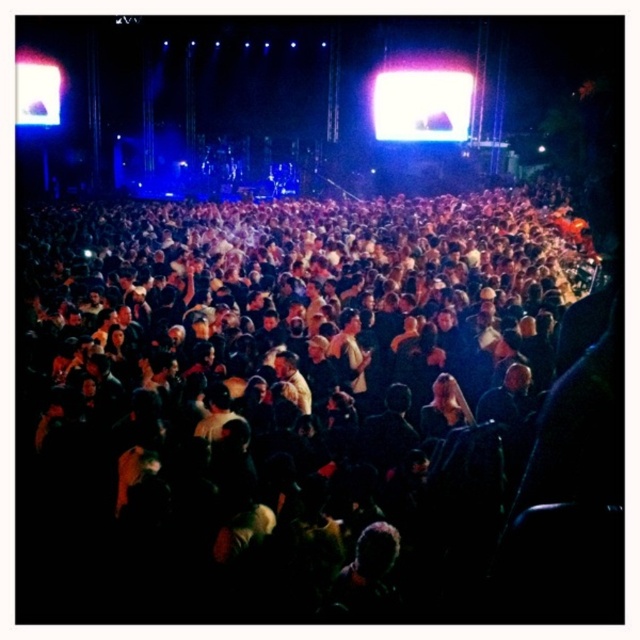
You are a stagehand at the concert and need to position a new spotlight. The spotlight can only be directed towards the dark matte crowd at center. Where should you aim the spotlight based on their coordinates?

The dark matte crowd at center is located at point (x=284, y=397), so aim the spotlight at those coordinates to target them accurately.

You are a photographer standing at the back of the concert venue. You want to take a photo of the bright white screen at upper center while also capturing the dark matte crowd at center in the same frame. Given the distance between them, can you adjust your camera settings to include both in a single shot without moving your position?

The dark matte crowd at center is 29.68 meters away from the bright white screen at upper center. Since the crowd and screen are at different distances and lighting conditions, adjusting the camera settings like aperture and focus might allow capturing both, but achieving sharp focus on both may be challenging due to the significant distance difference.

You are a photographer at the concert and want to capture a photo that includes both the dark matte crowd at center and the bright white screen at upper center. Based on their positions, which object should you adjust your camera focus to first to ensure both are in the frame?

The dark matte crowd at center is to the left of bright white screen at upper center. To include both in the frame, you should first focus on the bright white screen at upper center since it is positioned higher up, ensuring there is enough space to include the crowd to its left.